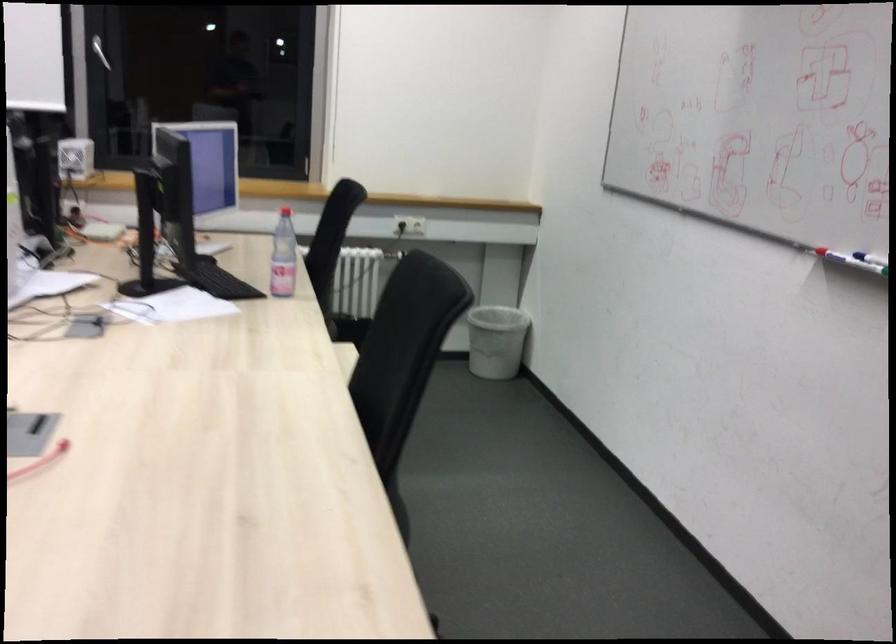
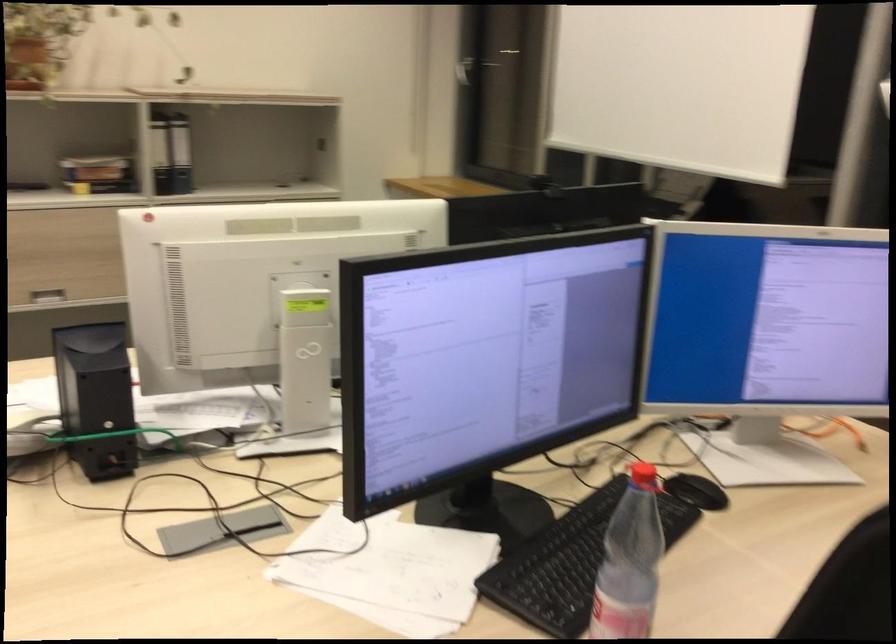
Find the pixel in the second image that matches (x=202, y=257) in the first image.

(695, 491)